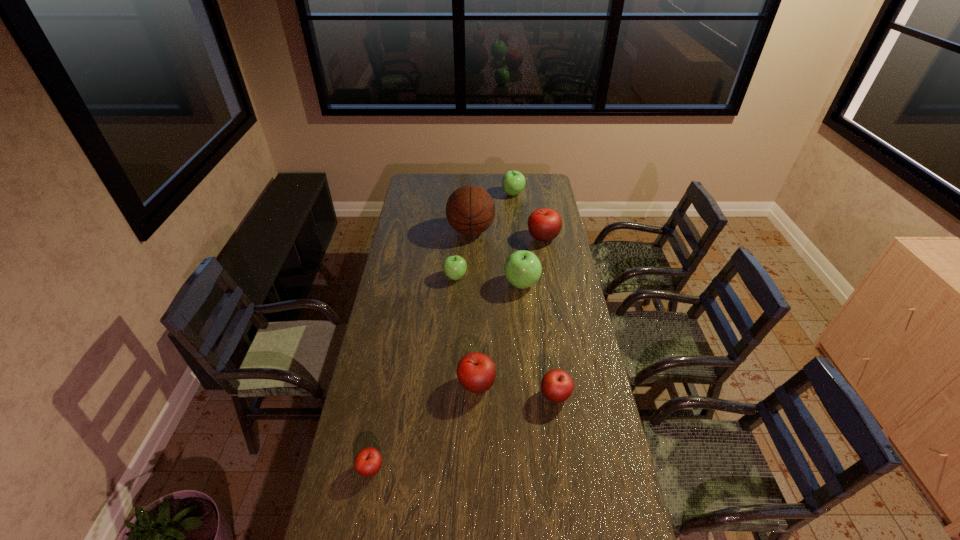
The height and width of the screenshot is (540, 960). In order to click on the smallest red apple in this screenshot , I will do `click(368, 461)`.

The image size is (960, 540). What are the coordinates of `the leftmost apple` in the screenshot? It's located at (368, 461).

The width and height of the screenshot is (960, 540). I want to click on free space located 0.320m on the side with brand label of the tallest object, so click(x=554, y=231).

You are a GUI agent. You are given a task and a screenshot of the screen. Output one action in this format:
    pyautogui.click(x=<x>, y=<y>)
    Task: Click on the vacant area situated on the left of the biggest green apple
    This screenshot has height=540, width=960.
    Given the screenshot: What is the action you would take?
    pyautogui.click(x=452, y=284)

Where is `free location located 0.090m on the left of the sixth nearest apple`? The image size is (960, 540). free location located 0.090m on the left of the sixth nearest apple is located at coordinates (510, 238).

The width and height of the screenshot is (960, 540). In order to click on free space located 0.050m on the back of the farthest apple in this screenshot , I will do `click(512, 184)`.

Locate an element on the screen. The image size is (960, 540). blank space located 0.080m on the left of the second biggest red apple is located at coordinates (436, 384).

At what (x,y) coordinates should I click in order to perform the action: click on free space located on the back of the smallest green apple. Please return your answer as a coordinate pair (x, y). Looking at the image, I should click on (458, 242).

Locate an element on the screen. This screenshot has height=540, width=960. vacant space situated 0.080m on the back of the third biggest red apple is located at coordinates (551, 365).

Identify the location of vacant space located on the back of the smallest red apple. The height and width of the screenshot is (540, 960). (386, 384).